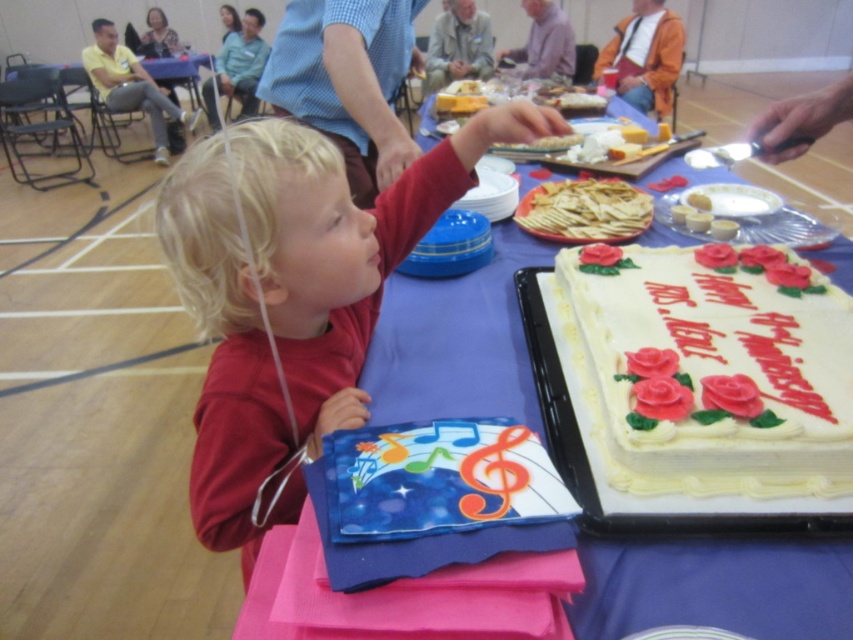
Can you confirm if red cotton shirt at center is thinner than white frosted cake with red roses at center?

No.

Does red cotton shirt at center come in front of white frosted cake with red roses at center?

That is False.

Which is in front, point (331, 408) or point (784, 324)?

Point (331, 408)

Find the location of a particular element. Image resolution: width=853 pixels, height=640 pixels. red cotton shirt at center is located at coordinates (294, 292).

Is light brown crispy crackers at center shorter than yellow cake at right?

In fact, light brown crispy crackers at center may be taller than yellow cake at right.

Between point (618, 212) and point (685, 198), which one is positioned in front?

Positioned in front is point (618, 212).

Is point (595, 204) positioned in front of point (694, 205)?

No, it is behind (694, 205).

Locate an element on the screen. light brown crispy crackers at center is located at coordinates (584, 211).

Describe the element at coordinates (294, 292) in the screenshot. The height and width of the screenshot is (640, 853). I see `red cotton shirt at center` at that location.

The image size is (853, 640). What are the coordinates of `red cotton shirt at center` in the screenshot? It's located at (294, 292).